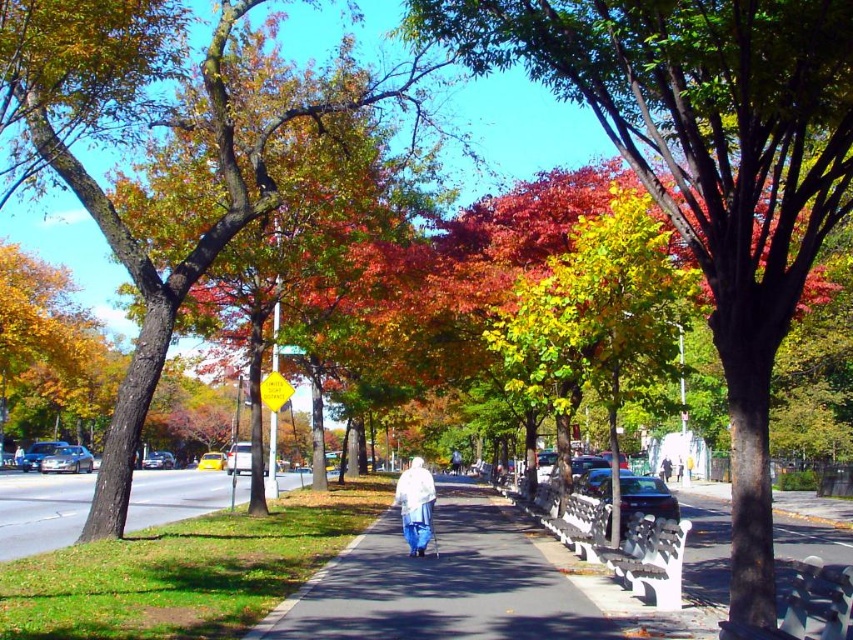
How distant is green leafy tree at center from gray asphalt at lower left?

green leafy tree at center and gray asphalt at lower left are 47.58 feet apart from each other.

Can you confirm if green leafy tree at center is smaller than gray asphalt at lower left?

Correct, green leafy tree at center occupies less space than gray asphalt at lower left.

What do you see at coordinates (705, 170) in the screenshot?
I see `green leafy tree at center` at bounding box center [705, 170].

In order to click on green leafy tree at center in this screenshot , I will do `click(705, 170)`.

Consider the image. Is smooth brown tree trunk at center taller than white fabric coat at center?

Correct, smooth brown tree trunk at center is much taller as white fabric coat at center.

Does smooth brown tree trunk at center appear on the right side of white fabric coat at center?

In fact, smooth brown tree trunk at center is to the left of white fabric coat at center.

Describe the element at coordinates (103, 189) in the screenshot. I see `smooth brown tree trunk at center` at that location.

Locate an element on the screen. smooth brown tree trunk at center is located at coordinates (103, 189).

Who is shorter, smooth brown tree trunk at center or gray asphalt at lower left?

gray asphalt at lower left

What are the coordinates of `smooth brown tree trunk at center` in the screenshot? It's located at (103, 189).

Who is more forward, (76, 115) or (45, 502)?

Point (76, 115)

At what (x,y) coordinates should I click in order to perform the action: click on smooth brown tree trunk at center. Please return your answer as a coordinate pair (x, y). Looking at the image, I should click on (103, 189).